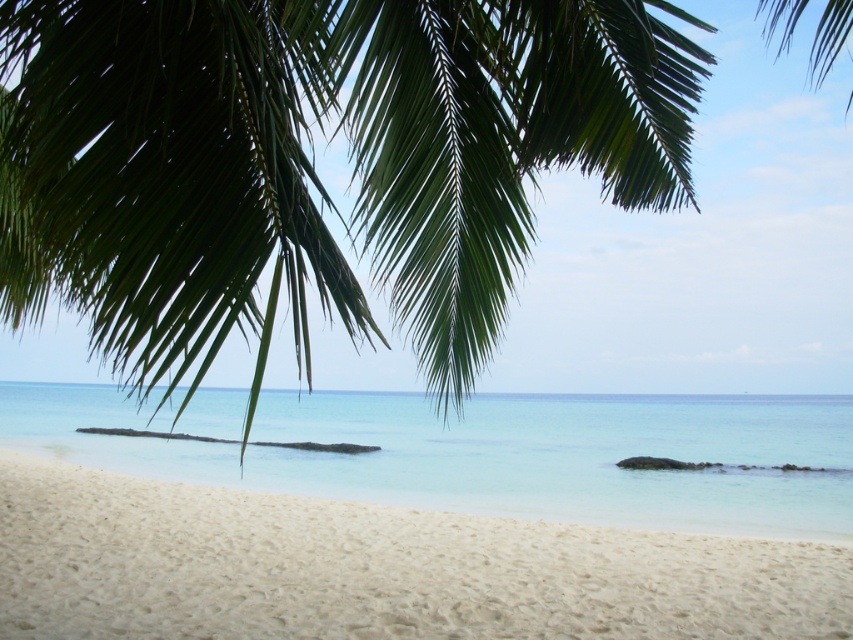
Question: Which object appears closest to the camera in this image?

Choices:
 (A) green leafy palm tree at upper left
 (B) white sandy beach at lower left
 (C) clear water at lower center

Answer: (A)

Question: Is green leafy palm tree at upper left positioned behind clear water at lower center?

Choices:
 (A) no
 (B) yes

Answer: (A)

Question: Is the position of white sandy beach at lower left more distant than that of clear water at lower center?

Choices:
 (A) yes
 (B) no

Answer: (B)

Question: Which point is farther from the camera taking this photo?

Choices:
 (A) [x=126, y=1]
 (B) [x=473, y=448]

Answer: (B)

Question: Is green leafy palm tree at upper left wider than clear water at lower center?

Choices:
 (A) no
 (B) yes

Answer: (A)

Question: Which is farther from the clear water at lower center?

Choices:
 (A) white sandy beach at lower left
 (B) green leafy palm tree at upper left

Answer: (B)